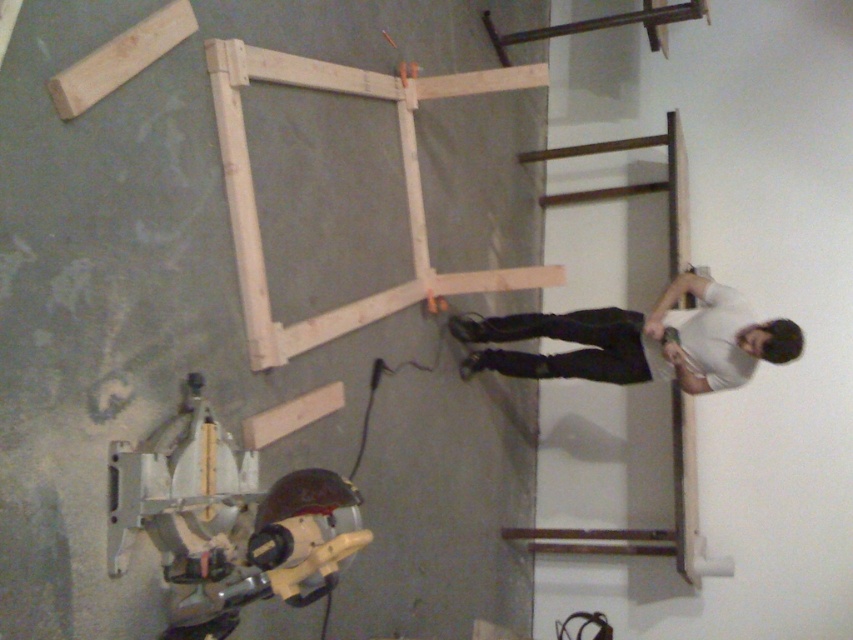
Question: Estimate the real-world distances between objects in this image. Which object is closer to the white matte shirt at center?

Choices:
 (A) metallic yellow circular saw at lower left
 (B) brown wood window frame at right

Answer: (B)

Question: Based on their relative distances, which object is farther from the metallic yellow circular saw at lower left?

Choices:
 (A) white matte shirt at center
 (B) brown wood window frame at right

Answer: (B)

Question: Does metallic yellow circular saw at lower left come behind white matte shirt at center?

Choices:
 (A) no
 (B) yes

Answer: (A)

Question: Does metallic yellow circular saw at lower left appear under white matte shirt at center?

Choices:
 (A) no
 (B) yes

Answer: (B)

Question: Which point is closer to the camera?

Choices:
 (A) (641, 182)
 (B) (160, 534)

Answer: (B)

Question: Is metallic yellow circular saw at lower left to the right of white matte shirt at center from the viewer's perspective?

Choices:
 (A) no
 (B) yes

Answer: (A)